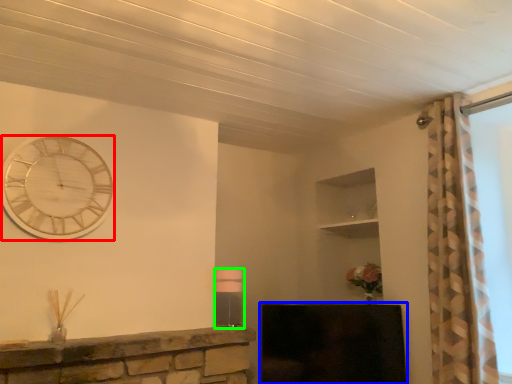
Question: Which object is positioned closest to wall clock (highlighted by a red box)? Select from fireplace (highlighted by a blue box) and lamp (highlighted by a green box).

Choices:
 (A) fireplace
 (B) lamp

Answer: (B)